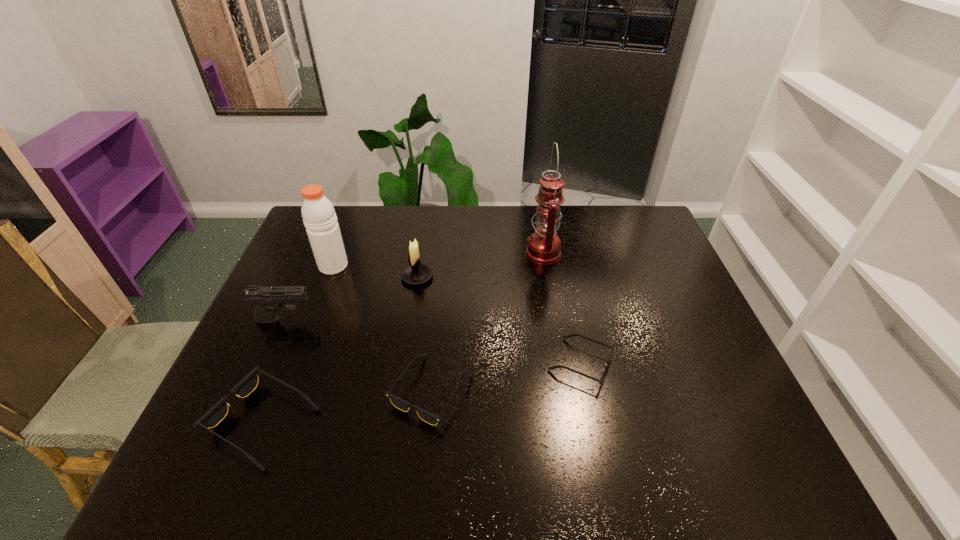
Identify the location of empty space between the leftmost sunglasses and the fourth farthest object. (275, 370).

You are a GUI agent. You are given a task and a screenshot of the screen. Output one action in this format:
    pyautogui.click(x=<x>, y=<y>)
    Task: Click on the vacant area that lies between the shortest object and the fourth farthest object
    
    Given the screenshot: What is the action you would take?
    pyautogui.click(x=433, y=342)

Identify the location of vacant point located between the leftmost sunglasses and the shortest sunglasses. (422, 393).

The image size is (960, 540). I want to click on vacant area between the oil lamp and the second tallest object, so click(x=438, y=259).

Image resolution: width=960 pixels, height=540 pixels. Identify the location of free space between the third tallest object and the leftmost sunglasses. (341, 349).

In order to click on free point between the third tallest object and the shortest sunglasses in this screenshot , I will do `click(499, 320)`.

Locate an element on the screen. Image resolution: width=960 pixels, height=540 pixels. object that is the closest one to the sixth shortest object is located at coordinates (267, 300).

Identify the location of object that ranks as the sixth closest to the candle holder. (571, 335).

Image resolution: width=960 pixels, height=540 pixels. I want to click on sunglasses that can be found as the closest to the second tallest sunglasses, so click(217, 413).

Choose which sunglasses is the third nearest neighbor to the oil lamp. Please provide its 2D coordinates. Your answer should be formatted as a tuple, i.e. [(x, y)], where the tuple contains the x and y coordinates of a point satisfying the conditions above.

[(217, 413)]